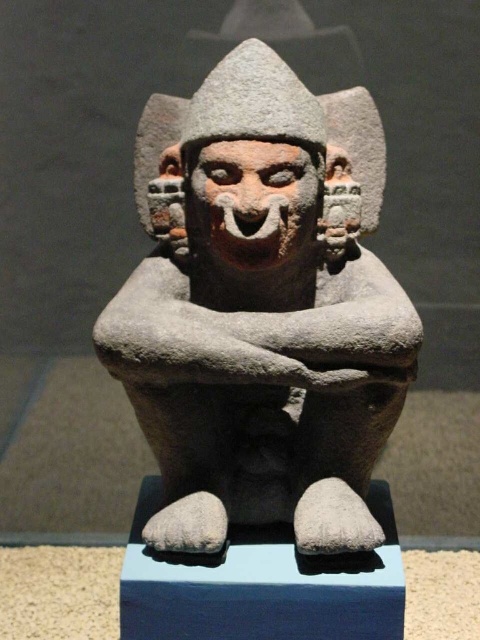
Question: Where is gray stone statue at center located in relation to matte stone head at center in the image?

Choices:
 (A) right
 (B) left

Answer: (A)

Question: Can you confirm if gray stone statue at center is bigger than matte stone head at center?

Choices:
 (A) yes
 (B) no

Answer: (A)

Question: Can you confirm if gray stone statue at center is positioned above matte stone head at center?

Choices:
 (A) no
 (B) yes

Answer: (A)

Question: Which point is closer to the camera?

Choices:
 (A) matte stone head at center
 (B) gray stone statue at center

Answer: (B)

Question: Which object is closer to the camera taking this photo?

Choices:
 (A) gray stone statue at center
 (B) matte stone head at center

Answer: (A)